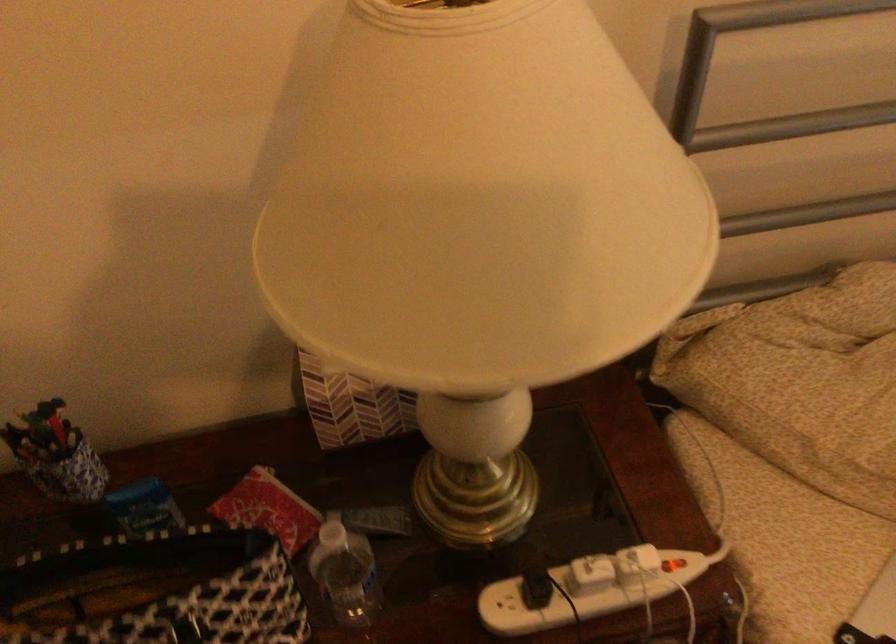
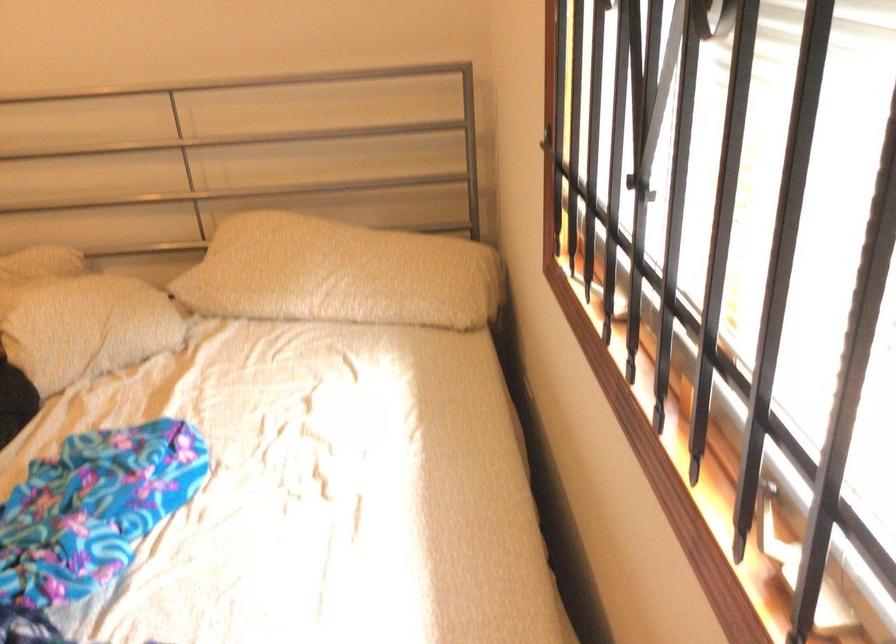
Which direction would the cameraman need to move to produce the second image?

The cameraman moved toward right, backward.